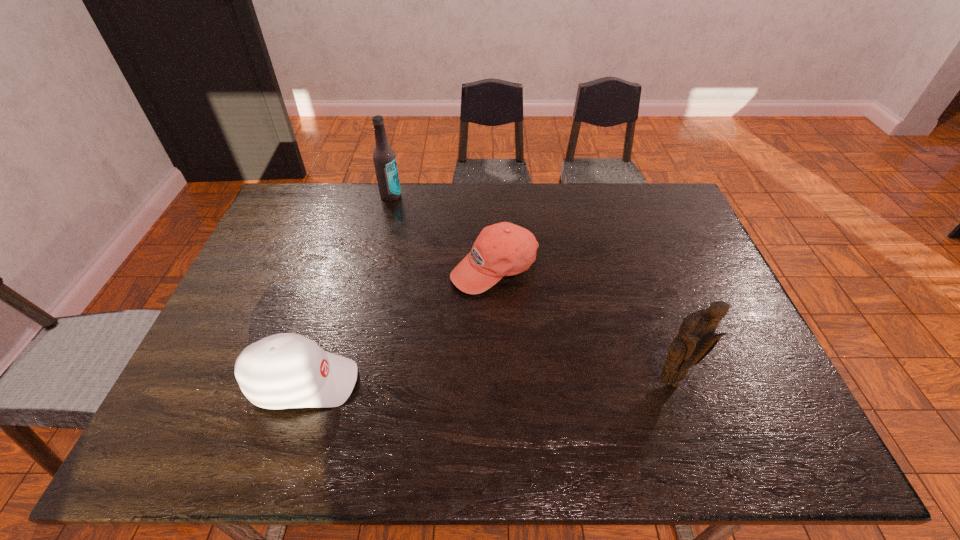
Find the location of a particular element. The image size is (960, 540). vacant area that lies between the rightmost object and the left baseball cap is located at coordinates (487, 382).

Where is `vacant space in between the beer bottle and the rightmost object`? The width and height of the screenshot is (960, 540). vacant space in between the beer bottle and the rightmost object is located at coordinates 531,289.

Where is `vacant point located between the beer bottle and the nearer baseball cap`? The height and width of the screenshot is (540, 960). vacant point located between the beer bottle and the nearer baseball cap is located at coordinates (347, 289).

This screenshot has width=960, height=540. In order to click on object that is the closest to the beer bottle in this screenshot , I will do `click(504, 249)`.

Identify which object is the third closest to the third nearest object. Please provide its 2D coordinates. Your answer should be formatted as a tuple, i.e. [(x, y)], where the tuple contains the x and y coordinates of a point satisfying the conditions above.

[(696, 339)]

This screenshot has height=540, width=960. I want to click on free space that satisfies the following two spatial constraints: 1. on the front side of the beer bottle; 2. on the left side of the farther baseball cap, so click(x=373, y=268).

Identify the location of free point that satisfies the following two spatial constraints: 1. on the front side of the second object from right to left; 2. on the left side of the beer bottle. Image resolution: width=960 pixels, height=540 pixels. (373, 268).